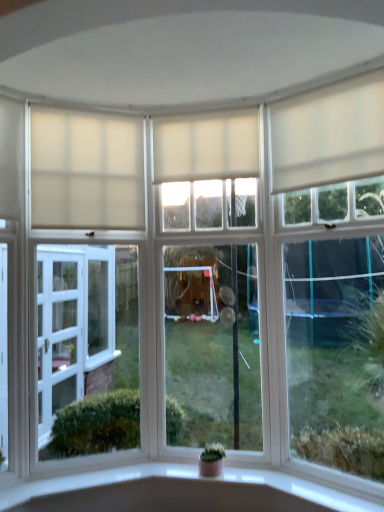
The height and width of the screenshot is (512, 384). I want to click on vacant space underneath white matte curtain at upper center, which is the first curtain from left to right (from a real-world perspective), so click(x=99, y=470).